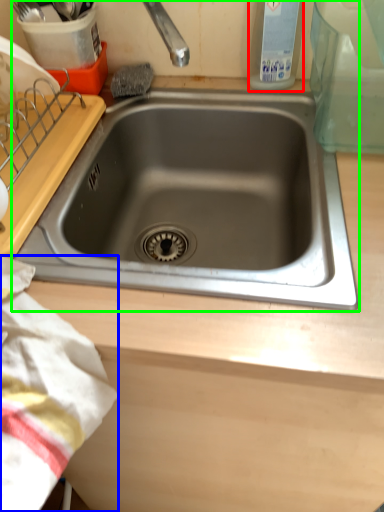
Question: Considering the real-world distances, which object is farthest from bottle (highlighted by a red box)? blanket (highlighted by a blue box) or sink (highlighted by a green box)?

Choices:
 (A) blanket
 (B) sink

Answer: (A)